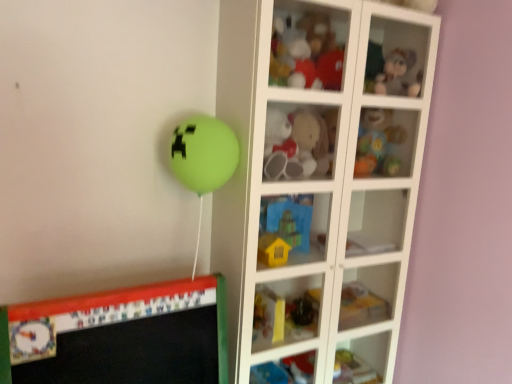
Question: From a real-world perspective, is fuzzy fabric plush toy at upper right, the 2th cabinet from the left, positioned over rubberized plastic baby rattle at upper right, which is the second toy in top-to-bottom order, based on gravity?

Choices:
 (A) no
 (B) yes

Answer: (B)

Question: From the image's perspective, is fuzzy fabric plush toy at upper right, which appears as the 1th cabinet when viewed from the top, above rubberized plastic baby rattle at upper right, positioned as the 5th toy in bottom-to-top order?

Choices:
 (A) yes
 (B) no

Answer: (A)

Question: Considering the relative sizes of fuzzy fabric plush toy at upper right, the 2th cabinet from the left, and rubberized plastic baby rattle at upper right, which is the second toy in top-to-bottom order, in the image provided, is fuzzy fabric plush toy at upper right, the 2th cabinet from the left, taller than rubberized plastic baby rattle at upper right, which is the second toy in top-to-bottom order,?

Choices:
 (A) yes
 (B) no

Answer: (B)

Question: Does fuzzy fabric plush toy at upper right, which appears as the 1th cabinet when viewed from the top, have a greater width compared to rubberized plastic baby rattle at upper right, which is the second toy in top-to-bottom order?

Choices:
 (A) no
 (B) yes

Answer: (B)

Question: From a real-world perspective, does fuzzy fabric plush toy at upper right, placed as the 1th cabinet when sorted from right to left, sit lower than rubberized plastic baby rattle at upper right, which is the second toy in top-to-bottom order?

Choices:
 (A) yes
 (B) no

Answer: (B)

Question: Is fuzzy fabric plush toy at upper right, which appears as the 1th cabinet when viewed from the top, next to rubberized plastic baby rattle at upper right, positioned as the 5th toy in bottom-to-top order?

Choices:
 (A) yes
 (B) no

Answer: (B)

Question: From a real-world perspective, is fuzzy fabric plush toy at upper right, placed as the 1th cabinet when sorted from right to left, physically above fluffy plush toy at center, placed as the third toy when sorted from top to bottom?

Choices:
 (A) no
 (B) yes

Answer: (B)

Question: Is fuzzy fabric plush toy at upper right, which appears as the 1th cabinet when viewed from the top, touching fluffy plush toy at center, placed as the third toy when sorted from top to bottom?

Choices:
 (A) yes
 (B) no

Answer: (B)

Question: Can you confirm if fuzzy fabric plush toy at upper right, which ranks as the 2th cabinet in bottom-to-top order, is smaller than fluffy plush toy at center, placed as the third toy when sorted from top to bottom?

Choices:
 (A) yes
 (B) no

Answer: (B)

Question: Is fuzzy fabric plush toy at upper right, the 2th cabinet from the left, to the left of fluffy plush toy at center, marked as the 4th toy in a bottom-to-top arrangement, from the viewer's perspective?

Choices:
 (A) yes
 (B) no

Answer: (B)

Question: Does fuzzy fabric plush toy at upper right, the 2th cabinet from the left, have a lesser width compared to fluffy plush toy at center, placed as the third toy when sorted from top to bottom?

Choices:
 (A) yes
 (B) no

Answer: (B)

Question: Is fuzzy fabric plush toy at upper right, which ranks as the 2th cabinet in bottom-to-top order, completely or partially outside of fluffy plush toy at center, marked as the 4th toy in a bottom-to-top arrangement?

Choices:
 (A) no
 (B) yes

Answer: (B)

Question: Would you say fluffy plush toy at center, placed as the third toy when sorted from top to bottom, is outside rubberized plastic baby rattle at upper right, which is the second toy in top-to-bottom order?

Choices:
 (A) yes
 (B) no

Answer: (A)